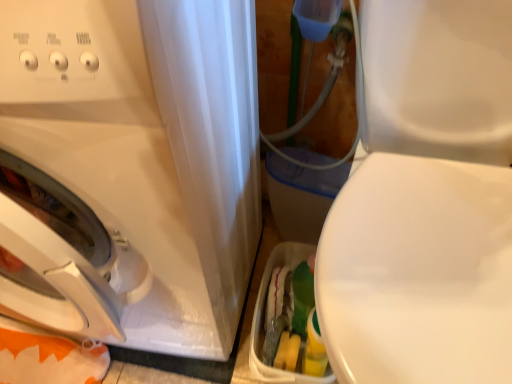
Question: In terms of size, does white glossy washing machine at left appear bigger or smaller than white glossy toilet at right?

Choices:
 (A) small
 (B) big

Answer: (B)

Question: Considering the positions of point (84, 296) and point (409, 31), is point (84, 296) closer or farther from the camera than point (409, 31)?

Choices:
 (A) farther
 (B) closer

Answer: (B)

Question: From the image's perspective, relative to white glossy toilet at right, is white glossy washing machine at left above or below?

Choices:
 (A) above
 (B) below

Answer: (A)

Question: In terms of width, does white glossy toilet at right look wider or thinner when compared to white glossy washing machine at left?

Choices:
 (A) wide
 (B) thin

Answer: (A)

Question: From a real-world perspective, relative to white glossy washing machine at left, is white glossy toilet at right vertically above or below?

Choices:
 (A) below
 (B) above

Answer: (A)

Question: From the image's perspective, is white glossy toilet at right above or below white glossy washing machine at left?

Choices:
 (A) below
 (B) above

Answer: (A)

Question: Would you say white glossy toilet at right is inside or outside white glossy washing machine at left?

Choices:
 (A) inside
 (B) outside

Answer: (B)